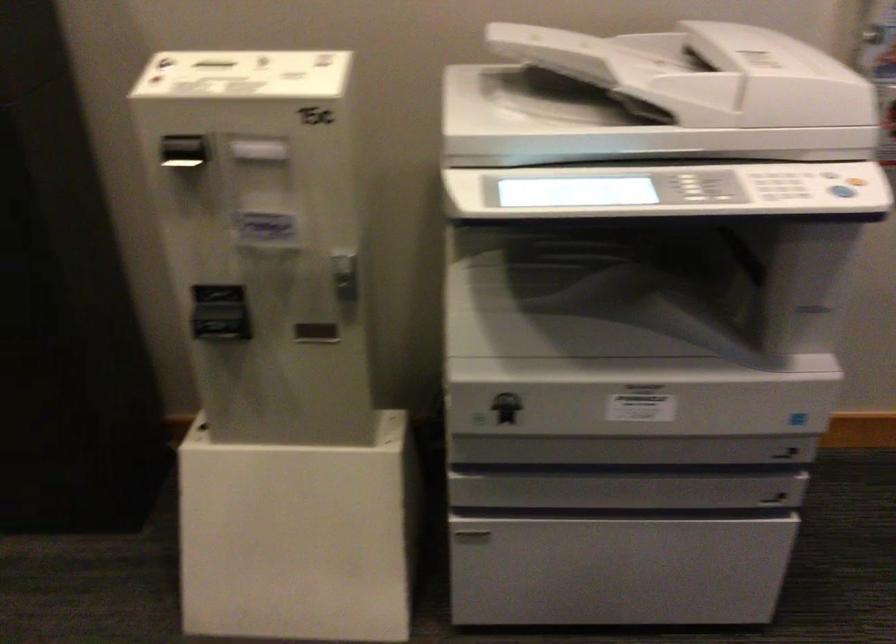
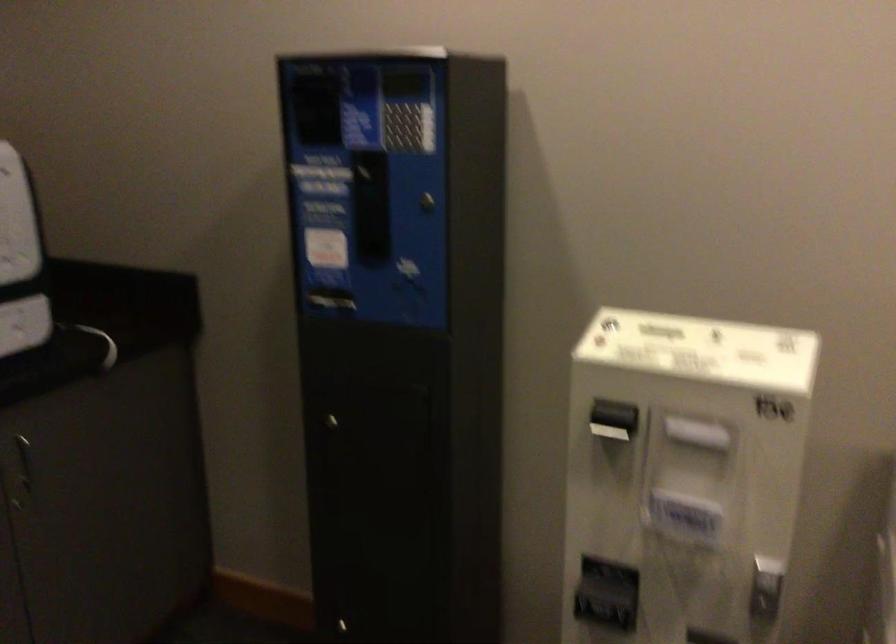
Question: How did the camera likely rotate?

Choices:
 (A) Left
 (B) Right
 (C) Up
 (D) Down

Answer: (A)